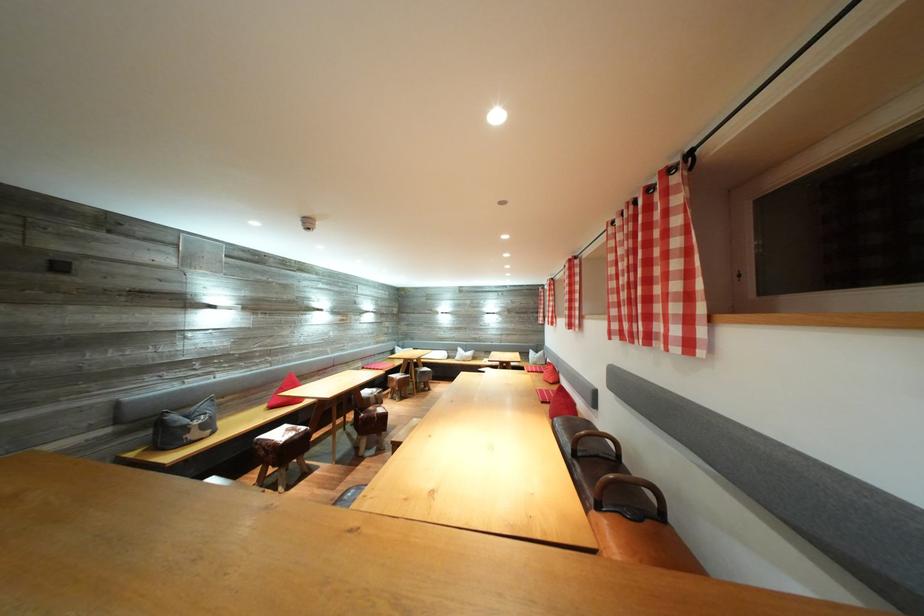
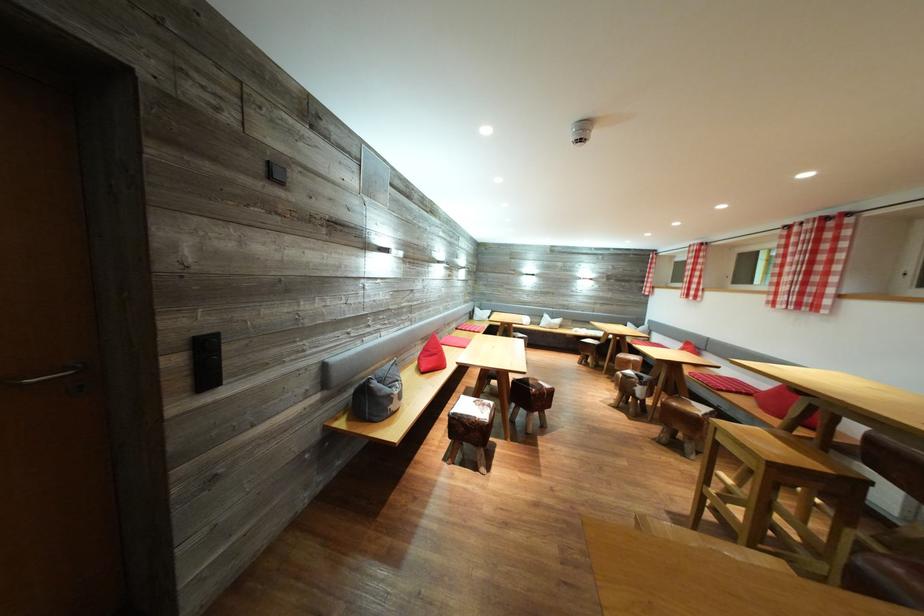
Question: The images are taken continuously from a first-person perspective. In which direction are you moving?

Choices:
 (A) Left
 (B) Right
 (C) Forward
 (D) Backward

Answer: (A)